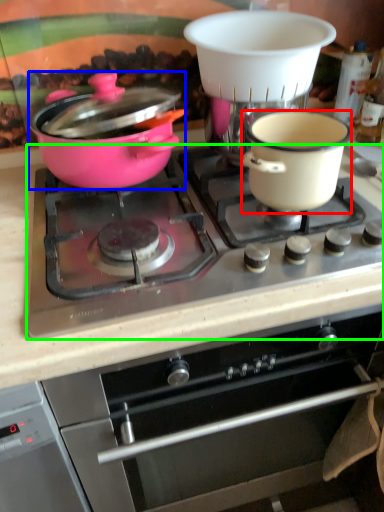
Question: Which object is positioned closest to bowl (highlighted by a red box)? Select from pot/pan (highlighted by a blue box) and gas stove (highlighted by a green box).

Choices:
 (A) pot/pan
 (B) gas stove

Answer: (B)